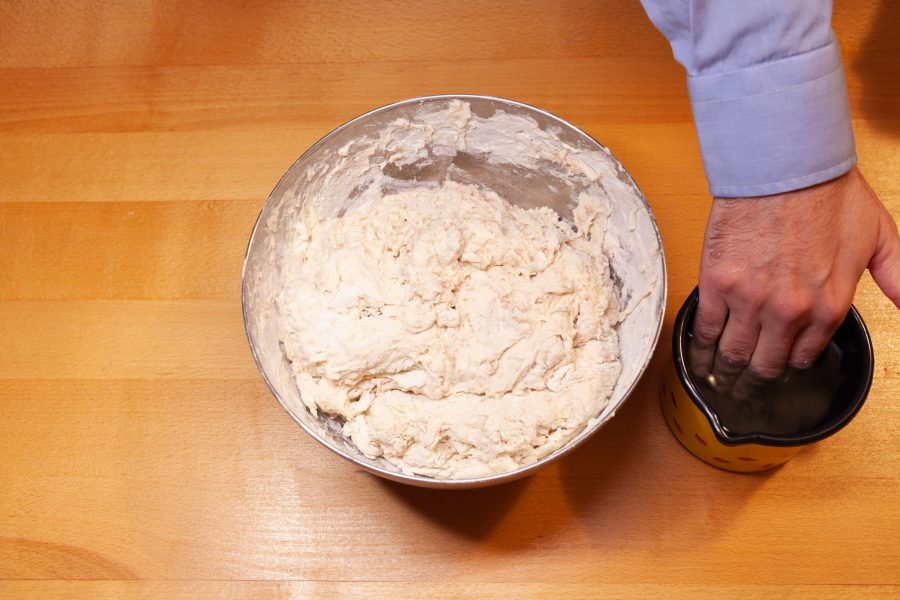
Where is `bowl`? bowl is located at coordinates (531, 180).